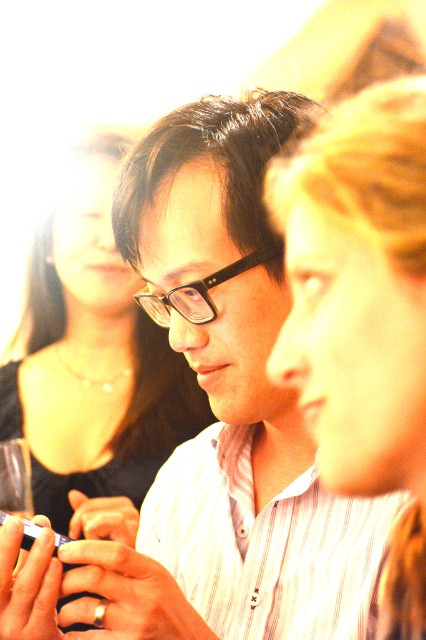
You are a photographer trying to capture a closeup of the man in the foreground. You notice the black glossy hair at upper left and the black plastic glasses at center. Which object is closer to the camera?

The black plastic glasses at center is closer to the camera than the black glossy hair at upper left because the hair is positioned under the glasses.

You are a photographer trying to capture a closeup of the black plastic glasses at center. However, the black glossy hair at upper left is blocking your view. Can you move the hair to the right to get a clear shot?

The black glossy hair at upper left is positioned on the left side of black plastic glasses at center, so moving the hair to the right would place it directly in front of the glasses, making it more obstructive. You should move the hair to the left instead to clear the view.